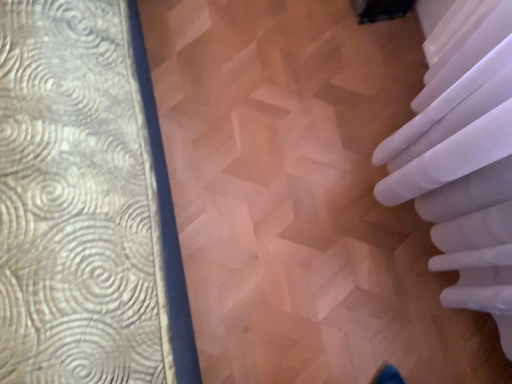
Image resolution: width=512 pixels, height=384 pixels. What do you see at coordinates (301, 196) in the screenshot?
I see `wooden parquet floor at center` at bounding box center [301, 196].

Identify the location of wooden parquet floor at center. (301, 196).

Find the location of a particular element. This screenshot has height=384, width=512. wooden parquet floor at center is located at coordinates (301, 196).